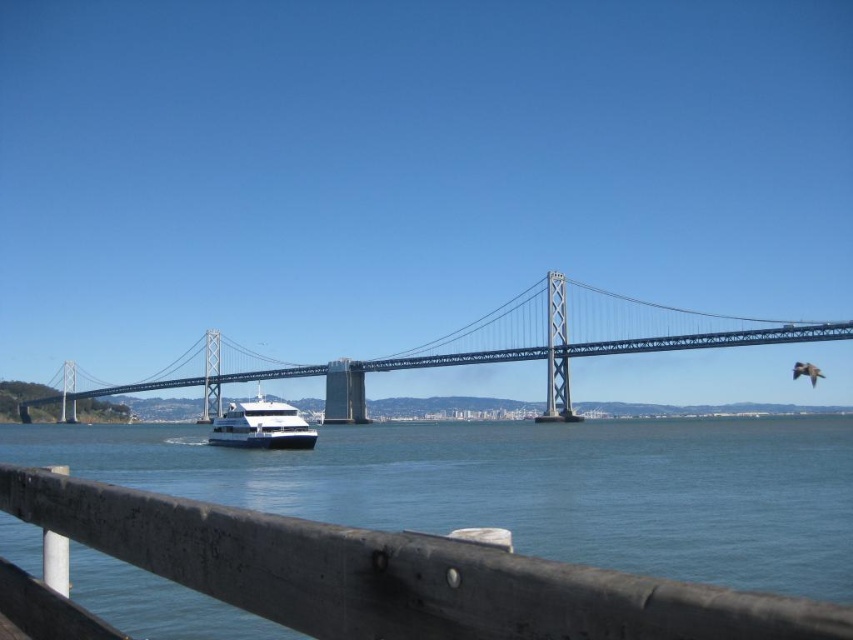
You are a passenger on the white glossy cruise ship at center. You look up and see the metallic gray bridge at center above you. Can you confirm if the bridge is directly above the cruise ship?

Yes, the metallic gray bridge at center is positioned over the white glossy cruise ship at center, so the bridge is directly above the cruise ship.

In the scene shown: You are standing on a pier and see the wooden rail at lower center and the metallic gray bridge at center. Which object is positioned to the right side from your viewpoint?

The wooden rail at lower center is positioned to the right of the metallic gray bridge at center, so the wooden rail at lower center is on the right side from your viewpoint.

You are standing on the wooden rail at lower center and want to take a photo of the white glossy cruise ship at center. Which direction should you face to ensure the cruise ship is fully visible in your camera frame?

Since the wooden rail at lower center is in front of the white glossy cruise ship at center, you should face forward to ensure the cruise ship is fully visible in your camera frame.